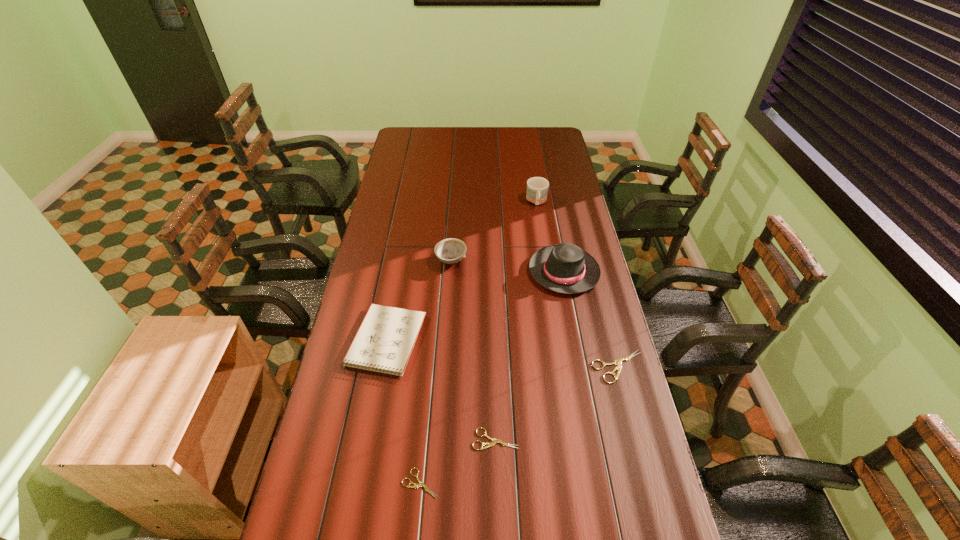
At what (x,y) coordinates should I click in order to perform the action: click on mug that is at the right edge. Please return your answer as a coordinate pair (x, y). The image size is (960, 540). Looking at the image, I should click on (537, 187).

I want to click on dress hat at the right edge, so click(x=565, y=268).

Where is `vacant space at the far edge`? vacant space at the far edge is located at coordinates (498, 133).

In the image, there is a desktop. Identify the location of vacant space at the left edge. The width and height of the screenshot is (960, 540). (389, 238).

In the image, there is a desktop. Where is `vacant space at the right edge`? vacant space at the right edge is located at coordinates tap(636, 442).

Where is `free region at the far left corner of the desktop`? Image resolution: width=960 pixels, height=540 pixels. free region at the far left corner of the desktop is located at coordinates (427, 129).

Locate an element on the screen. The image size is (960, 540). vacant space at the near left corner of the desktop is located at coordinates (354, 478).

Identify the location of blank space at the far right corner of the desktop. (535, 131).

Locate an element on the screen. Image resolution: width=960 pixels, height=540 pixels. vacant space that is in between the shortest shears and the third shortest object is located at coordinates (519, 425).

Locate an element on the screen. vacant space that is in between the third tallest object and the notepad is located at coordinates (419, 301).